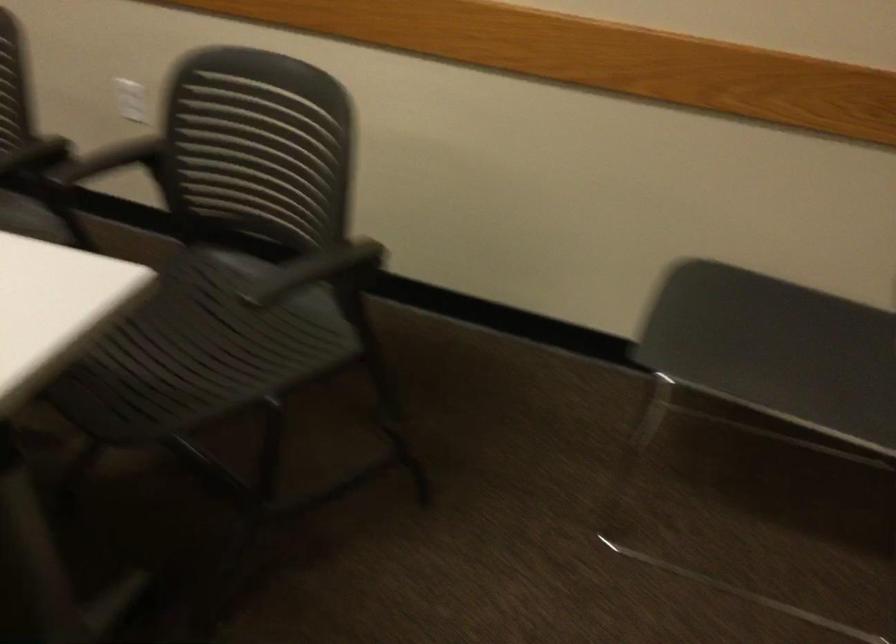
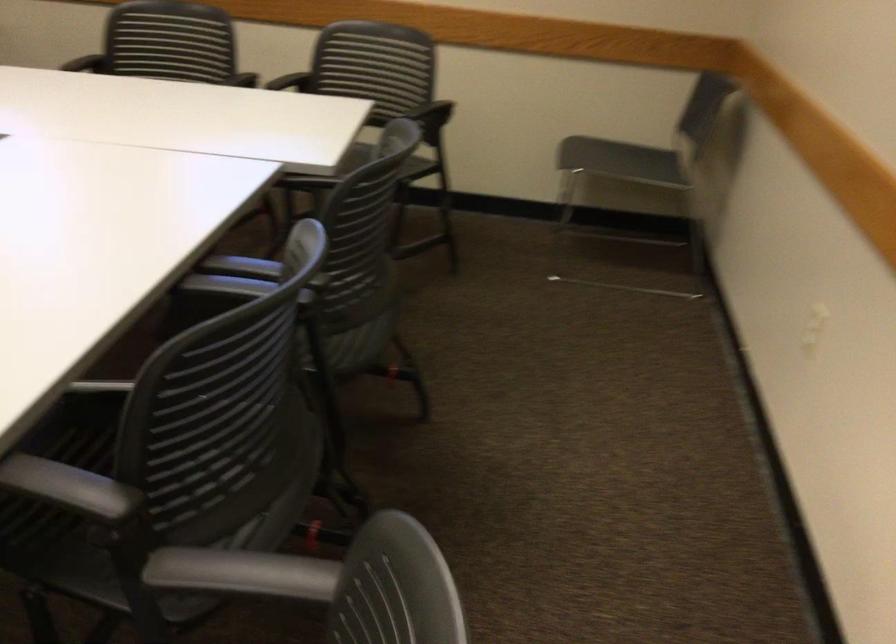
The point at (x=347, y=274) is marked in the first image. Where is the corresponding point in the second image?

(433, 118)